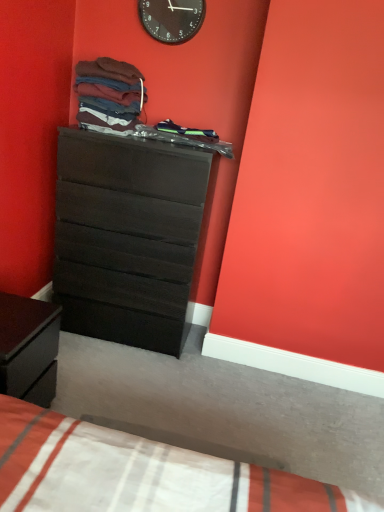
At what (x,y) coordinates should I click in order to perform the action: click on dark blue fabric at center, arranged as the first clothing when viewed from the right. Please return your answer as a coordinate pair (x, y). The height and width of the screenshot is (512, 384). Looking at the image, I should click on (187, 131).

What do you see at coordinates (187, 131) in the screenshot?
I see `dark blue fabric at center, arranged as the first clothing when viewed from the right` at bounding box center [187, 131].

What do you see at coordinates (26, 342) in the screenshot?
I see `dark wood nightstand at lower left` at bounding box center [26, 342].

I want to click on black plastic wall clock at upper center, so click(x=172, y=19).

What is the approximate height of matte black dresser at center?

matte black dresser at center is 1.22 meters tall.

In order to face matte black dresser at center, should I rotate leftwards or rightwards?

You should rotate left by 7.504 degrees.

I want to click on dark blue fabric at center, arranged as the first clothing when viewed from the right, so click(187, 131).

Which object is more forward, black plastic wall clock at upper center or dark blue fabric at center, the second clothing from the left?

dark blue fabric at center, the second clothing from the left, is in front.

Is black plastic wall clock at upper center wider or thinner than dark blue fabric at center, the second clothing from the left?

black plastic wall clock at upper center is thinner than dark blue fabric at center, the second clothing from the left.

Considering the sizes of objects black plastic wall clock at upper center and dark blue fabric at center, the second clothing from the left, in the image provided, who is smaller, black plastic wall clock at upper center or dark blue fabric at center, the second clothing from the left,?

With smaller size is black plastic wall clock at upper center.

Which is closer to the camera, (177, 6) or (189, 129)?

The point (177, 6) is in front.

From a real-world perspective, which is physically below, black plastic wall clock at upper center or white cotton bed at lower left?

white cotton bed at lower left is physically lower.

Based on their sizes in the image, would you say black plastic wall clock at upper center is bigger or smaller than white cotton bed at lower left?

In the image, black plastic wall clock at upper center appears to be smaller than white cotton bed at lower left.

Are black plastic wall clock at upper center and white cotton bed at lower left making contact?

black plastic wall clock at upper center and white cotton bed at lower left are not in contact.

From a real-world perspective, which object rests below the other?

matte black dresser at center, from a real-world perspective.

Considering the sizes of black plastic wall clock at upper center and matte black dresser at center in the image, is black plastic wall clock at upper center wider or thinner than matte black dresser at center?

black plastic wall clock at upper center is thinner than matte black dresser at center.

Considering the sizes of black plastic wall clock at upper center and matte black dresser at center in the image, is black plastic wall clock at upper center bigger or smaller than matte black dresser at center?

In the image, black plastic wall clock at upper center appears to be smaller than matte black dresser at center.

Is black plastic wall clock at upper center positioned far away from matte black dresser at center?

black plastic wall clock at upper center is positioned a significant distance from matte black dresser at center.

Is matte black dresser at center in contact with dark wood nightstand at lower left?

No, matte black dresser at center is not making contact with dark wood nightstand at lower left.

Who is taller, matte black dresser at center or dark wood nightstand at lower left?

matte black dresser at center is taller.

From the picture: Which is nearer, (182,253) or (32,351)?

The point (32,351) is closer.

Based on the photo, which is more to the right, matte black dresser at center or dark wood nightstand at lower left?

Positioned to the right is matte black dresser at center.

Can you confirm if matte black dresser at center is smaller than white cotton bed at lower left?

Actually, matte black dresser at center might be larger than white cotton bed at lower left.

Is matte black dresser at center facing away from white cotton bed at lower left?

matte black dresser at center does not have its back to white cotton bed at lower left.

Is point (63, 317) closer to viewer compared to point (304, 497)?

No, (63, 317) is further to viewer.

Is matte cotton shirts at upper center, the 1th clothing in the left-to-right sequence, positioned far away from black plastic wall clock at upper center?

matte cotton shirts at upper center, the 1th clothing in the left-to-right sequence, is near black plastic wall clock at upper center, not far away.

Would you say matte cotton shirts at upper center, the second clothing when ordered from right to left, is to the left or to the right of black plastic wall clock at upper center in the picture?

From the image, it's evident that matte cotton shirts at upper center, the second clothing when ordered from right to left, is to the left of black plastic wall clock at upper center.

Can you confirm if matte cotton shirts at upper center, the 1th clothing in the left-to-right sequence, is thinner than black plastic wall clock at upper center?

No, matte cotton shirts at upper center, the 1th clothing in the left-to-right sequence, is not thinner than black plastic wall clock at upper center.

Locate an element on the screen. wall clock that appears above the matte cotton shirts at upper center, the 1th clothing in the left-to-right sequence (from the image's perspective) is located at coordinates (172, 19).

Considering the relative sizes of matte black dresser at center and matte cotton shirts at upper center, the 1th clothing in the left-to-right sequence, in the image provided, is matte black dresser at center shorter than matte cotton shirts at upper center, the 1th clothing in the left-to-right sequence,?

Incorrect, the height of matte black dresser at center does not fall short of that of matte cotton shirts at upper center, the 1th clothing in the left-to-right sequence.

From a real-world perspective, is matte black dresser at center located beneath matte cotton shirts at upper center, the 1th clothing in the left-to-right sequence?

Yes, from a real-world perspective, matte black dresser at center is below matte cotton shirts at upper center, the 1th clothing in the left-to-right sequence.

Are matte black dresser at center and matte cotton shirts at upper center, the second clothing when ordered from right to left, making contact?

matte black dresser at center and matte cotton shirts at upper center, the second clothing when ordered from right to left, are clearly separated.

The height and width of the screenshot is (512, 384). I want to click on the 1st clothing in front of the black plastic wall clock at upper center, starting your count from the anchor, so click(x=187, y=131).

The height and width of the screenshot is (512, 384). Find the location of `bed that appears on the right of black plastic wall clock at upper center`. bed that appears on the right of black plastic wall clock at upper center is located at coordinates 138,473.

Based on their spatial positions, is white cotton bed at lower left or matte black dresser at center further from dark wood nightstand at lower left?

The object further to dark wood nightstand at lower left is matte black dresser at center.

Looking at the image, which one is located closer to white cotton bed at lower left, matte black dresser at center or matte cotton shirts at upper center, the second clothing when ordered from right to left?

The object closer to white cotton bed at lower left is matte black dresser at center.

When comparing their distances from dark blue fabric at center, arranged as the first clothing when viewed from the right, does matte cotton shirts at upper center, the second clothing when ordered from right to left, or white cotton bed at lower left seem closer?

Among the two, matte cotton shirts at upper center, the second clothing when ordered from right to left, is located nearer to dark blue fabric at center, arranged as the first clothing when viewed from the right.

From the picture: When comparing their distances from dark wood nightstand at lower left, does dark blue fabric at center, arranged as the first clothing when viewed from the right, or matte black dresser at center seem further?

Based on the image, dark blue fabric at center, arranged as the first clothing when viewed from the right, appears to be further to dark wood nightstand at lower left.

Based on their spatial positions, is black plastic wall clock at upper center or white cotton bed at lower left further from dark wood nightstand at lower left?

black plastic wall clock at upper center is further to dark wood nightstand at lower left.

Considering their positions, is white cotton bed at lower left positioned closer to matte black dresser at center than dark blue fabric at center, arranged as the first clothing when viewed from the right?

dark blue fabric at center, arranged as the first clothing when viewed from the right, is closer to matte black dresser at center.

From the image, which object appears to be farther from dark wood nightstand at lower left, matte cotton shirts at upper center, the 1th clothing in the left-to-right sequence, or white cotton bed at lower left?

The object further to dark wood nightstand at lower left is matte cotton shirts at upper center, the 1th clothing in the left-to-right sequence.

Looking at the image, which one is located closer to matte cotton shirts at upper center, the 1th clothing in the left-to-right sequence, matte black dresser at center or dark wood nightstand at lower left?

Among the two, matte black dresser at center is located nearer to matte cotton shirts at upper center, the 1th clothing in the left-to-right sequence.

Where is `chest of drawers between dark blue fabric at center, arranged as the first clothing when viewed from the right, and dark wood nightstand at lower left in the up-down direction`? Image resolution: width=384 pixels, height=512 pixels. chest of drawers between dark blue fabric at center, arranged as the first clothing when viewed from the right, and dark wood nightstand at lower left in the up-down direction is located at coordinates (126, 238).

The width and height of the screenshot is (384, 512). What are the coordinates of `nightstand between matte cotton shirts at upper center, the second clothing when ordered from right to left, and white cotton bed at lower left in the up-down direction` in the screenshot? It's located at (26, 342).

Identify the location of the chest of drawers that lies between matte cotton shirts at upper center, the 1th clothing in the left-to-right sequence, and white cotton bed at lower left from top to bottom. The height and width of the screenshot is (512, 384). (126, 238).

What are the coordinates of `chest of drawers between black plastic wall clock at upper center and dark wood nightstand at lower left from top to bottom` in the screenshot? It's located at (126, 238).